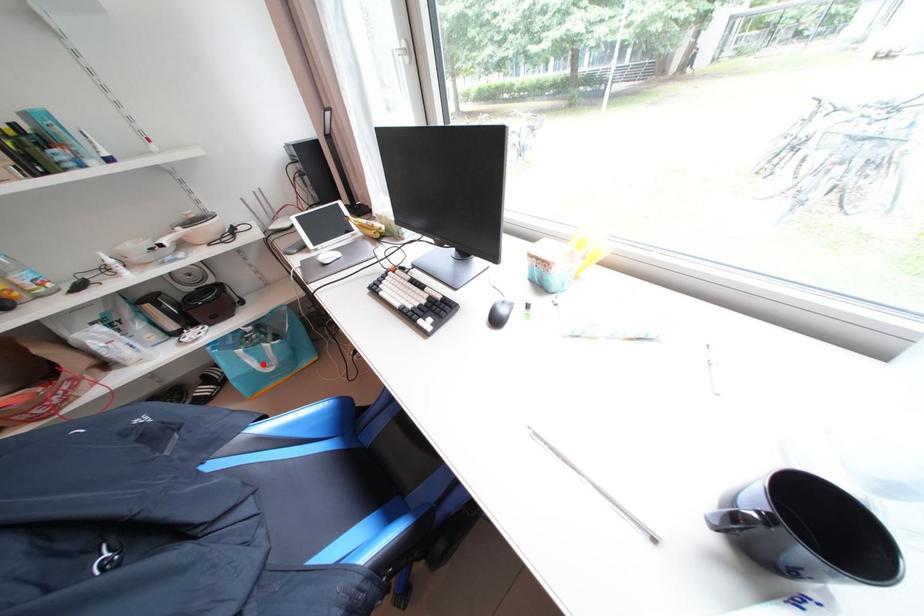
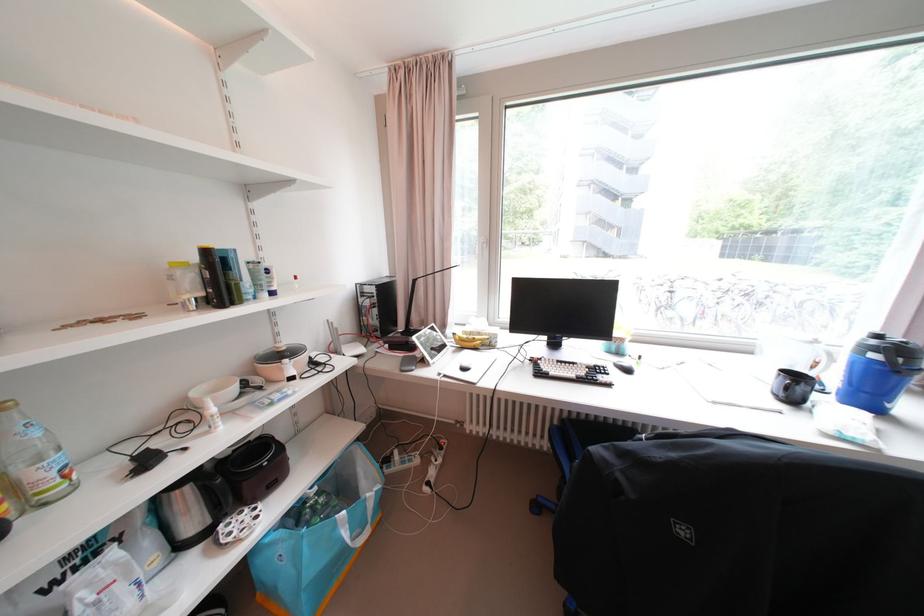
Question: A red point is marked in image1. In image2, is the corresponding 3D point closer to the camera or farther? Reply with the corresponding letter.

Choices:
 (A) The corresponding 3D point is closer.
 (B) The corresponding 3D point is farther.

Answer: (B)